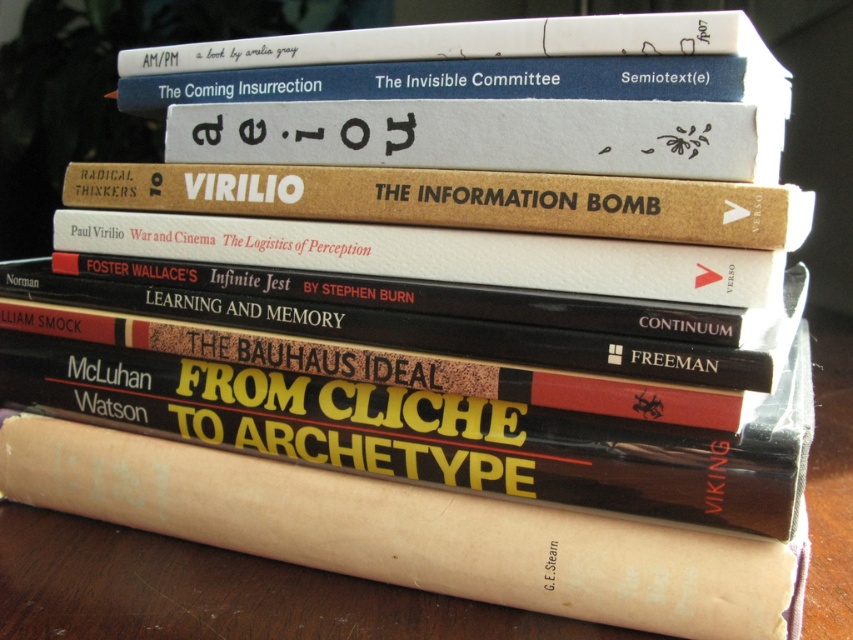
Who is higher up, brown paper book at center or brown cardboard book at center?

brown cardboard book at center

Does brown paper book at center have a greater width compared to brown cardboard book at center?

Yes, brown paper book at center is wider than brown cardboard book at center.

Between point (517, 529) and point (160, 188), which one is positioned in front?

Point (517, 529) is more forward.

This screenshot has height=640, width=853. In order to click on brown paper book at center in this screenshot , I will do `click(412, 532)`.